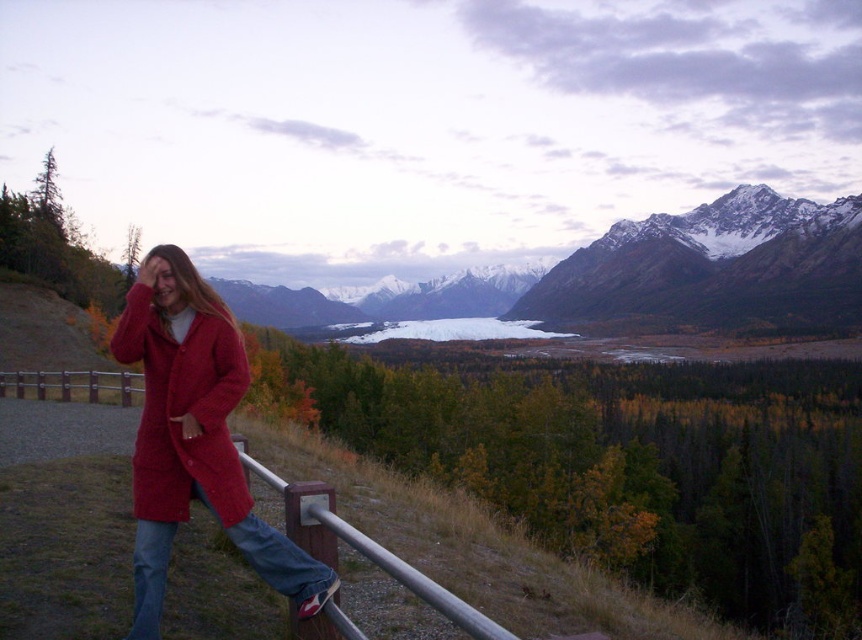
Consider the image. Does matte red coat at center have a smaller size compared to matte red coat at left?

Incorrect, matte red coat at center is not smaller in size than matte red coat at left.

Can you confirm if matte red coat at center is positioned below matte red coat at left?

No.

What do you see at coordinates (194, 436) in the screenshot? I see `matte red coat at center` at bounding box center [194, 436].

Locate an element on the screen. Image resolution: width=862 pixels, height=640 pixels. matte red coat at center is located at coordinates (194, 436).

Can you confirm if matte red coat at left is positioned to the left of brushed metal rail at lower center?

Correct, you'll find matte red coat at left to the left of brushed metal rail at lower center.

Is matte red coat at left thinner than brushed metal rail at lower center?

Yes, matte red coat at left is thinner than brushed metal rail at lower center.

Image resolution: width=862 pixels, height=640 pixels. Identify the location of matte red coat at left. (183, 410).

Where is `matte red coat at left`? The height and width of the screenshot is (640, 862). matte red coat at left is located at coordinates (183, 410).

Is matte red coat at center wider than brushed metal rail at lower center?

Yes.

Measure the distance from matte red coat at center to brushed metal rail at lower center.

The distance of matte red coat at center from brushed metal rail at lower center is 3.91 meters.

Who is more distant from viewer, (151, 467) or (495, 627)?

The point (151, 467) is behind.

Identify the location of matte red coat at center. (194, 436).